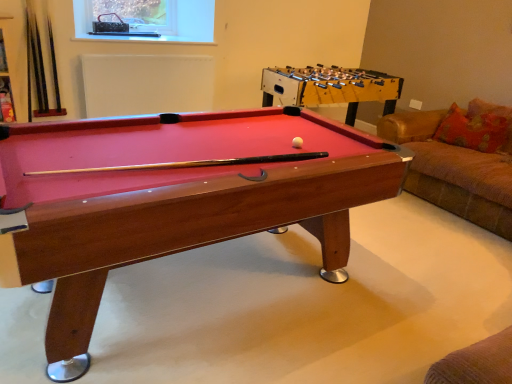
Question: From the image's perspective, is wooden billiard table at center under orange fabric pillow at right?

Choices:
 (A) no
 (B) yes

Answer: (B)

Question: Does wooden billiard table at center appear on the left side of orange fabric pillow at right?

Choices:
 (A) no
 (B) yes

Answer: (B)

Question: Is wooden billiard table at center placed right next to orange fabric pillow at right?

Choices:
 (A) yes
 (B) no

Answer: (B)

Question: Does wooden billiard table at center have a lesser width compared to orange fabric pillow at right?

Choices:
 (A) no
 (B) yes

Answer: (A)

Question: Does wooden billiard table at center come in front of orange fabric pillow at right?

Choices:
 (A) yes
 (B) no

Answer: (A)

Question: From a real-world perspective, is wooden billiard table at center under orange fabric pillow at right?

Choices:
 (A) no
 (B) yes

Answer: (B)

Question: Is wooden billiard table at center facing away from wooden foosball table at center?

Choices:
 (A) yes
 (B) no

Answer: (B)

Question: Could wooden foosball table at center be considered to be inside wooden billiard table at center?

Choices:
 (A) yes
 (B) no

Answer: (B)

Question: Is wooden billiard table at center to the left of wooden foosball table at center from the viewer's perspective?

Choices:
 (A) no
 (B) yes

Answer: (B)

Question: From the image's perspective, is wooden billiard table at center on wooden foosball table at center?

Choices:
 (A) no
 (B) yes

Answer: (A)

Question: Does wooden billiard table at center appear on the right side of wooden foosball table at center?

Choices:
 (A) no
 (B) yes

Answer: (A)

Question: From a real-world perspective, does wooden billiard table at center sit lower than wooden foosball table at center?

Choices:
 (A) yes
 (B) no

Answer: (A)

Question: Is the surface of wooden foosball table at center in direct contact with metallic mesh at upper center?

Choices:
 (A) no
 (B) yes

Answer: (A)